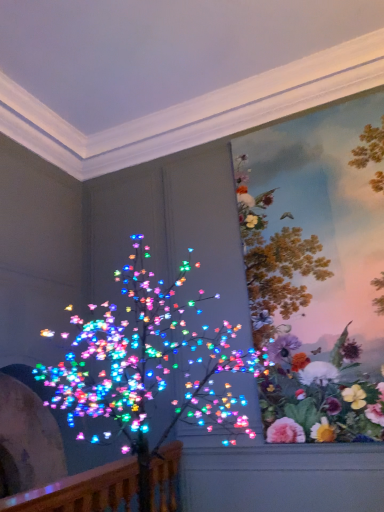
Question: From a real-world perspective, is floral wallpaper at upper right physically above wooden at left?

Choices:
 (A) yes
 (B) no

Answer: (A)

Question: Is wooden at left a part of floral wallpaper at upper right?

Choices:
 (A) no
 (B) yes

Answer: (A)

Question: From the image's perspective, is floral wallpaper at upper right below wooden at left?

Choices:
 (A) yes
 (B) no

Answer: (B)

Question: Does floral wallpaper at upper right have a smaller size compared to wooden at left?

Choices:
 (A) yes
 (B) no

Answer: (B)

Question: Considering the relative positions of floral wallpaper at upper right and wooden at left in the image provided, is floral wallpaper at upper right behind wooden at left?

Choices:
 (A) yes
 (B) no

Answer: (A)

Question: From their relative heights in the image, would you say multicolored lights at left is taller or shorter than floral wallpaper at upper right?

Choices:
 (A) short
 (B) tall

Answer: (A)

Question: From the image's perspective, is multicolored lights at left above or below floral wallpaper at upper right?

Choices:
 (A) below
 (B) above

Answer: (A)

Question: In the image, is multicolored lights at left positioned in front of or behind floral wallpaper at upper right?

Choices:
 (A) behind
 (B) front

Answer: (B)

Question: In terms of width, does multicolored lights at left look wider or thinner when compared to floral wallpaper at upper right?

Choices:
 (A) thin
 (B) wide

Answer: (B)

Question: Is wooden at left taller or shorter than multicolored lights at left?

Choices:
 (A) short
 (B) tall

Answer: (A)

Question: Is point (87, 471) positioned closer to the camera than point (132, 335)?

Choices:
 (A) farther
 (B) closer

Answer: (A)

Question: Is wooden at left wider or thinner than multicolored lights at left?

Choices:
 (A) thin
 (B) wide

Answer: (A)

Question: Which is correct: wooden at left is inside multicolored lights at left, or outside of it?

Choices:
 (A) outside
 (B) inside

Answer: (B)

Question: Based on their sizes in the image, would you say wooden at left is bigger or smaller than floral wallpaper at upper right?

Choices:
 (A) small
 (B) big

Answer: (A)

Question: Considering their positions, is wooden at left located in front of or behind floral wallpaper at upper right?

Choices:
 (A) behind
 (B) front

Answer: (B)